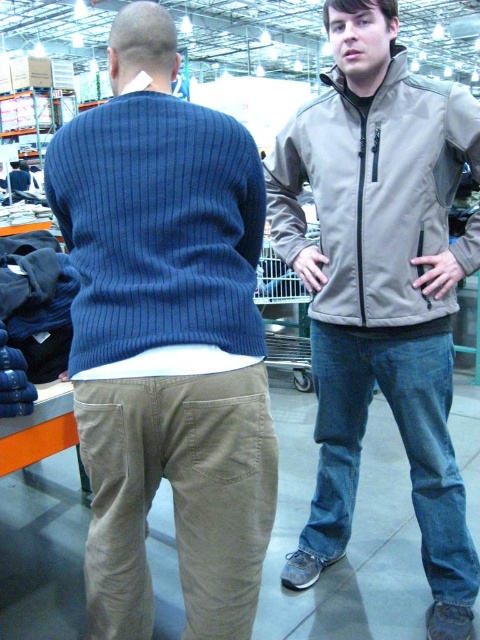
You are standing at the entrance of the store and see the point marked at coordinates [381,288]. What object is located at that point?

The point at coordinates [381,288] corresponds to the matte khaki pants at center.

You are a store employee who needs to place a 30 inch wide box between the khaki cotton pants at back and the tan softshell jacket at upper right. Can the box fit in the space between them?

The khaki cotton pants at back and tan softshell jacket at upper right are 31.17 inches apart from each other. Since the box is 30 inches wide, it can fit in the space between them as there is enough room.

You are a store employee who needs to retrieve an item from a high shelf. You see the matte khaki pants at center and the metallic silver shopping cart at center. Which object is positioned higher and could potentially help you reach the item?

The matte khaki pants at center is located above the metallic silver shopping cart at center, so it is positioned higher and could potentially help you reach the item.